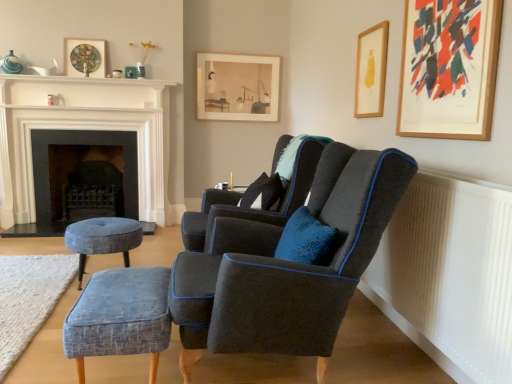
Locate an element on the screen. free area below wooden framed artwork at upper right, marked as the 4th picture frame in a left-to-right arrangement (from a real-world perspective) is located at coordinates (440, 170).